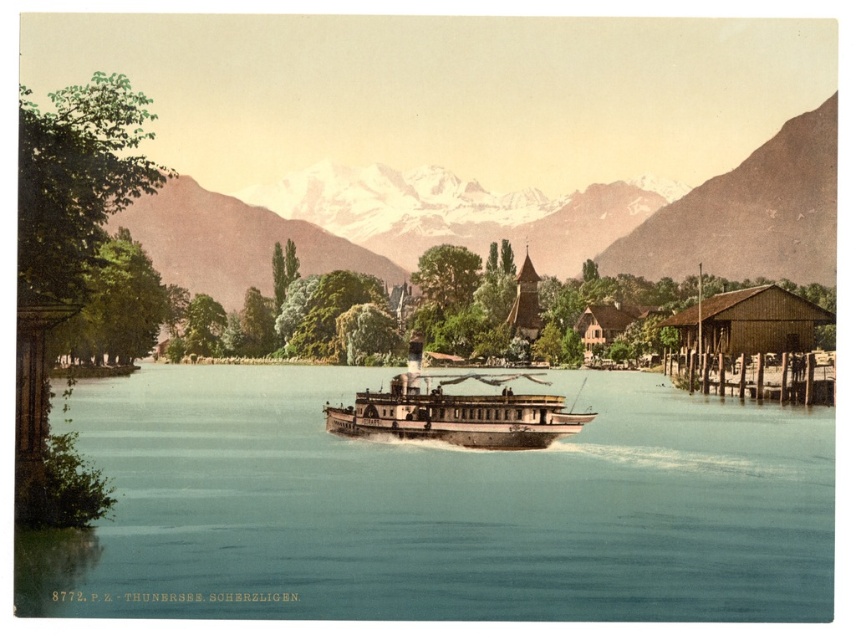
Does snowy mountain at upper center come in front of wooden polished boat at center?

No, snowy mountain at upper center is behind wooden polished boat at center.

In order to click on snowy mountain at upper center in this screenshot , I will do `click(749, 214)`.

Does blue water at center lie in front of snowy mountain at upper center?

Yes, it is in front of snowy mountain at upper center.

Is point (768, 472) closer to viewer compared to point (823, 266)?

Yes, it is in front of point (823, 266).

What are the coordinates of `blue water at center` in the screenshot? It's located at (437, 508).

Image resolution: width=856 pixels, height=640 pixels. Describe the element at coordinates (437, 508) in the screenshot. I see `blue water at center` at that location.

Is point (710, 429) less distant than point (510, 422)?

No, it is not.

Where is `blue water at center`? The image size is (856, 640). blue water at center is located at coordinates (437, 508).